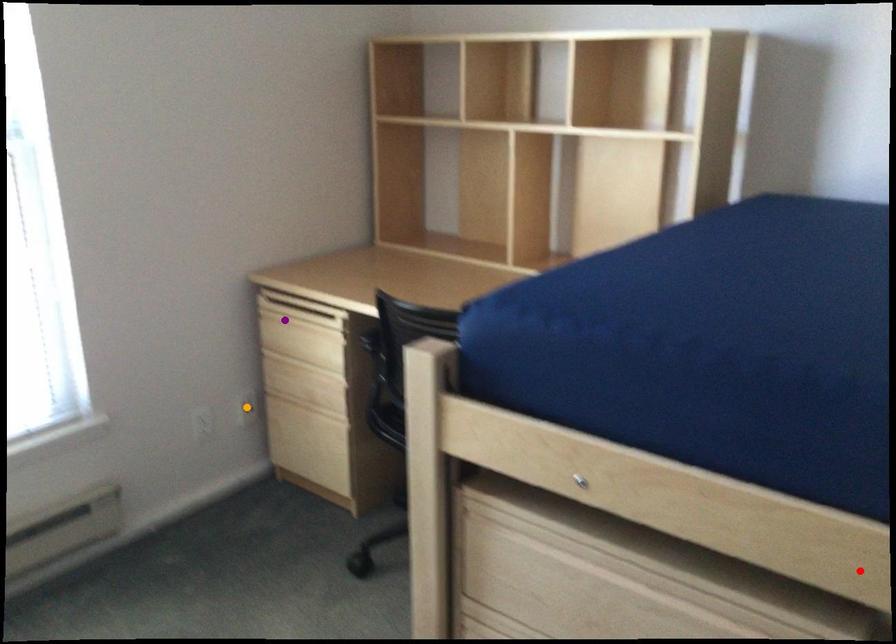
Order these from nearest to farthest:
1. red point
2. purple point
3. orange point

1. orange point
2. purple point
3. red point